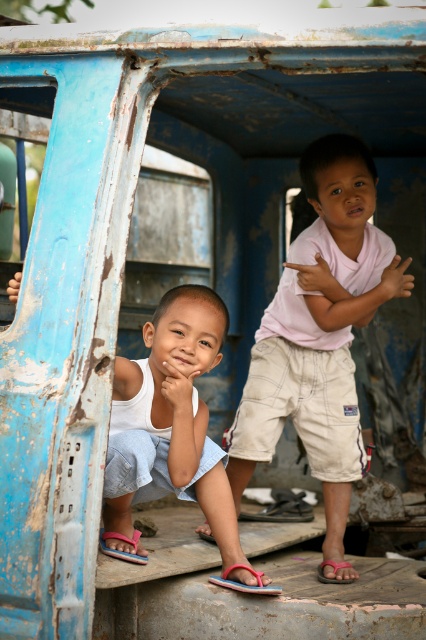
Question: Which is farther from the pink rubber sandal at lower center?

Choices:
 (A) white denim shorts at lower left
 (B) pink fabric sandal at lower center
 (C) pink fabric sandal at lower left
 (D) pink cotton shirt at upper right

Answer: (D)

Question: Which of these objects is positioned closest to the pink cotton shirt at upper right?

Choices:
 (A) pink rubber sandal at lower center
 (B) white denim shorts at lower left
 (C) pink fabric sandal at lower center

Answer: (B)

Question: Is white denim shorts at lower left to the left of pink fabric sandal at lower center from the viewer's perspective?

Choices:
 (A) yes
 (B) no

Answer: (A)

Question: Can you confirm if white denim shorts at lower left is positioned below pink rubber sandal at lower center?

Choices:
 (A) yes
 (B) no

Answer: (B)

Question: Which point is farther to the camera?

Choices:
 (A) pink fabric sandal at lower center
 (B) pink cotton shirt at upper right
 (C) white denim shorts at lower left

Answer: (A)

Question: Can you confirm if pink rubber sandal at lower center is positioned to the right of pink fabric sandal at lower center?

Choices:
 (A) yes
 (B) no

Answer: (B)